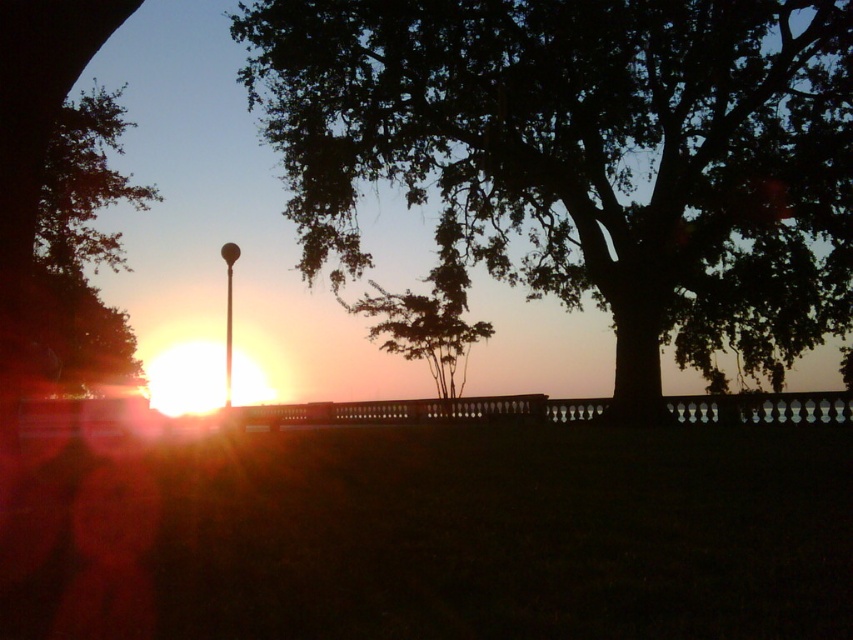
You are a photographer wanting to capture the sunset with both the green leafy tree at left and the metallic pole at center in your shot. From your current position, can you see both objects simultaneously without moving your camera? Explain your reasoning based on their positions.

Yes, you can see both the green leafy tree at left and the metallic pole at center simultaneously because the green leafy tree at left is in front of the metallic pole at center, meaning they are not blocking each other from view.

You are standing at the center of the image and want to walk towards the green leafy tree at left. Which direction should you face to head directly towards it?

The green leafy tree at left is located at point 0.388 on the x and 0.097 on the y, so you should face towards the left and slightly forward to head directly towards it.